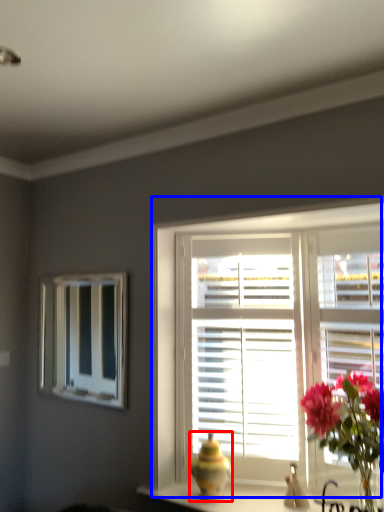
Question: Which of the following is the closest to the observer, vase (highlighted by a red box) or window (highlighted by a blue box)?

Choices:
 (A) vase
 (B) window

Answer: (B)